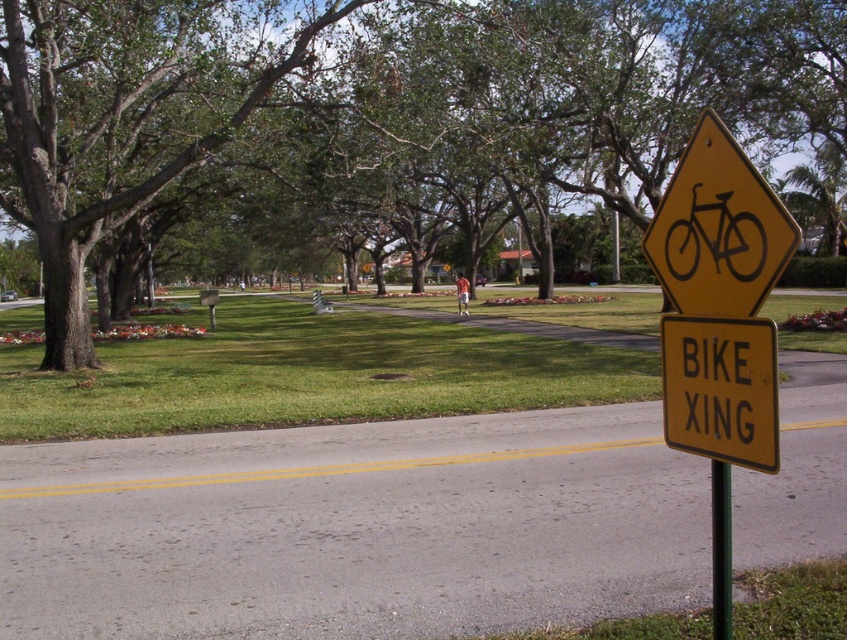
Question: Does green leafy tree at center come behind green metallic pole at right?

Choices:
 (A) no
 (B) yes

Answer: (B)

Question: Which point is farther to the camera?

Choices:
 (A) green leafy tree at center
 (B) yellow/black/traffic sign at right
 (C) green metallic pole at right

Answer: (A)

Question: Estimate the real-world distances between objects in this image. Which object is farther from the yellow/yellowish metal/yellow metal sign at right?

Choices:
 (A) green leafy tree at center
 (B) green metallic pole at right

Answer: (A)

Question: Is yellow diamond-shaped bike sign at right to the right of yellow/yellowish metal/yellow metal sign at right from the viewer's perspective?

Choices:
 (A) yes
 (B) no

Answer: (A)

Question: Is green leafy tree at center to the left of green metallic pole at right from the viewer's perspective?

Choices:
 (A) yes
 (B) no

Answer: (B)

Question: Which point is farther from the camera taking this photo?

Choices:
 (A) (796, 227)
 (B) (687, 397)
 (C) (717, 577)
 (D) (740, 220)

Answer: (C)